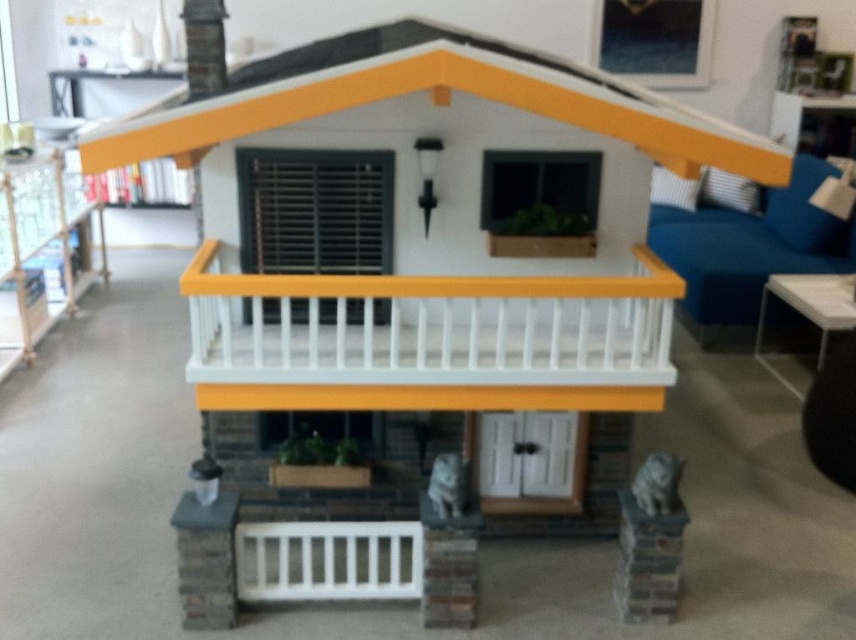
Question: Can you confirm if white painted wood balustrade at center is positioned above metallic silver bookshelf at left?

Choices:
 (A) yes
 (B) no

Answer: (B)

Question: Which of these objects is positioned farthest from the metallic silver bookshelf at left?

Choices:
 (A) white painted wood balustrade at lower center
 (B) white painted wood balustrade at center

Answer: (B)

Question: Does white painted wood balustrade at center have a smaller size compared to metallic silver bookshelf at left?

Choices:
 (A) no
 (B) yes

Answer: (B)

Question: Considering the real-world distances, which object is closest to the metallic silver bookshelf at left?

Choices:
 (A) white painted wood balustrade at center
 (B) white painted wood balustrade at lower center

Answer: (B)

Question: Does white painted wood balustrade at center appear under metallic silver bookshelf at left?

Choices:
 (A) yes
 (B) no

Answer: (A)

Question: Estimate the real-world distances between objects in this image. Which object is closer to the white painted wood balustrade at lower center?

Choices:
 (A) metallic silver bookshelf at left
 (B) white painted wood balustrade at center

Answer: (B)